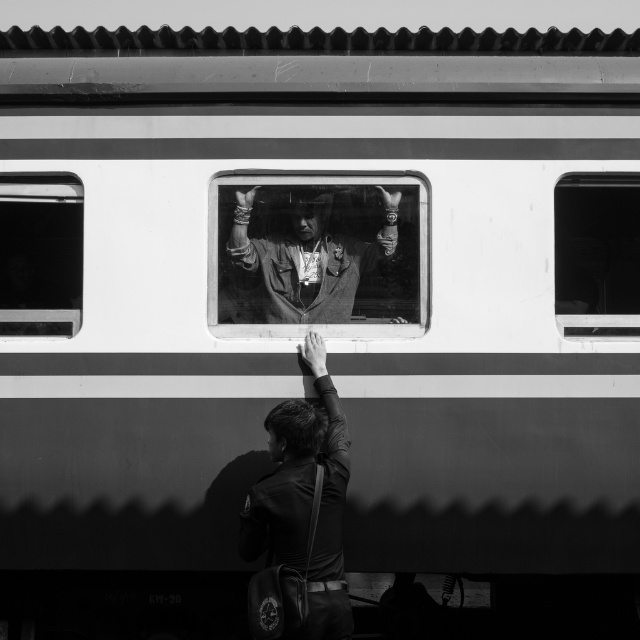
You are a photographer analyzing this black and white photo. You notice the matte leather jacket at center and the transparent glass window at right. Which object is closer to you, the viewer?

The matte leather jacket at center is closer to the viewer than the transparent glass window at right.

You are a photographer analyzing this black and white photo. You notice two transparent glass windows in the scene. Which one is positioned closer to you, the transparent glass window at right or the transparent glass window at upper left?

The transparent glass window at right is closer to the viewer than the transparent glass window at upper left.